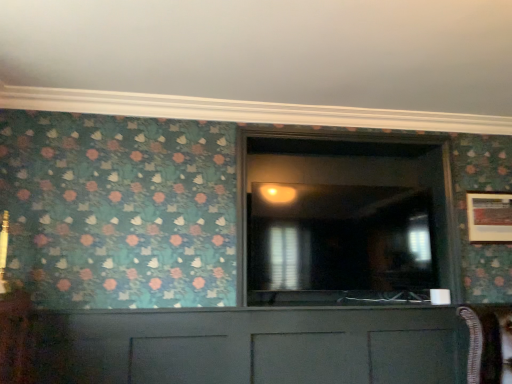
What is the approximate width of matte gray cabinet at center?

2.44 inches.

At what (x,y) coordinates should I click in order to perform the action: click on matte gray cabinet at center. Please return your answer as a coordinate pair (x, y). Looking at the image, I should click on (254, 346).

Would you say matte gray cabinet at center is outside wooden picture frame at right?

matte gray cabinet at center lies outside wooden picture frame at right's area.

Considering the positions of objects matte gray cabinet at center and wooden picture frame at right in the image provided, who is more to the right, matte gray cabinet at center or wooden picture frame at right?

wooden picture frame at right.

Considering the relative sizes of matte gray cabinet at center and wooden picture frame at right in the image provided, is matte gray cabinet at center wider than wooden picture frame at right?

Indeed, matte gray cabinet at center has a greater width compared to wooden picture frame at right.

From a real-world perspective, is matte gray cabinet at center physically located above or below wooden picture frame at right?

matte gray cabinet at center is below wooden picture frame at right.

Between matte gray cabinet at center and transparent glass door at center, which one appears on the right side from the viewer's perspective?

From the viewer's perspective, transparent glass door at center appears more on the right side.

Which object is thinner, matte gray cabinet at center or transparent glass door at center?

With smaller width is matte gray cabinet at center.

Identify the location of cabinetry below the transparent glass door at center (from the image's perspective). (254, 346).

Which object is wider, wooden picture frame at right or matte gray cabinet at center?

With larger width is matte gray cabinet at center.

Is wooden picture frame at right oriented away from matte gray cabinet at center?

No.

Considering the positions of objects wooden picture frame at right and matte gray cabinet at center in the image provided, who is more to the left, wooden picture frame at right or matte gray cabinet at center?

Positioned to the left is matte gray cabinet at center.

Considering the relative sizes of wooden picture frame at right and matte gray cabinet at center in the image provided, is wooden picture frame at right shorter than matte gray cabinet at center?

Indeed, wooden picture frame at right has a lesser height compared to matte gray cabinet at center.

From the image's perspective, is transparent glass door at center located above matte gray cabinet at center?

Yes, from the image's perspective, transparent glass door at center is above matte gray cabinet at center.

Looking at their sizes, would you say transparent glass door at center is wider or thinner than matte gray cabinet at center?

transparent glass door at center is wider than matte gray cabinet at center.

Is transparent glass door at center oriented towards matte gray cabinet at center?

No, transparent glass door at center does not turn towards matte gray cabinet at center.

From a real-world perspective, is transparent glass door at center positioned above or below wooden picture frame at right?

From a real-world perspective, transparent glass door at center is physically above wooden picture frame at right.

Is transparent glass door at center to the right of wooden picture frame at right from the viewer's perspective?

No.

Is transparent glass door at center positioned behind wooden picture frame at right?

No, transparent glass door at center is in front of wooden picture frame at right.

Is transparent glass door at center placed right next to wooden picture frame at right?

transparent glass door at center is not next to wooden picture frame at right, and they're not touching.

Could you tell me if wooden picture frame at right is facing transparent glass door at center?

No, wooden picture frame at right does not turn towards transparent glass door at center.

Locate an element on the screen. The height and width of the screenshot is (384, 512). picture frame located on the right of transparent glass door at center is located at coordinates (489, 217).

Is wooden picture frame at right to the right of transparent glass door at center from the viewer's perspective?

Correct, you'll find wooden picture frame at right to the right of transparent glass door at center.

Is wooden picture frame at right taller or shorter than transparent glass door at center?

In the image, wooden picture frame at right appears to be shorter than transparent glass door at center.

Locate an element on the screen. This screenshot has height=384, width=512. picture frame that is on the right side of matte gray cabinet at center is located at coordinates (489, 217).

Image resolution: width=512 pixels, height=384 pixels. In order to click on cabinetry on the left of the transparent glass door at center in this screenshot , I will do `click(254, 346)`.

Based on the photo, which object lies further to the anchor point wooden picture frame at right, matte gray cabinet at center or transparent glass door at center?

matte gray cabinet at center.

Which object lies further to the anchor point matte gray cabinet at center, wooden picture frame at right or transparent glass door at center?

The object further to matte gray cabinet at center is wooden picture frame at right.

Looking at the image, which one is located further to matte gray cabinet at center, transparent glass door at center or wooden picture frame at right?

The object further to matte gray cabinet at center is wooden picture frame at right.

From the image, which object appears to be nearer to transparent glass door at center, matte gray cabinet at center or wooden picture frame at right?

Among the two, matte gray cabinet at center is located nearer to transparent glass door at center.

From the image, which object appears to be nearer to transparent glass door at center, wooden picture frame at right or matte gray cabinet at center?

matte gray cabinet at center lies closer to transparent glass door at center than the other object.

Estimate the real-world distances between objects in this image. Which object is closer to wooden picture frame at right, transparent glass door at center or matte gray cabinet at center?

transparent glass door at center is closer to wooden picture frame at right.

You are a GUI agent. You are given a task and a screenshot of the screen. Output one action in this format:
    pyautogui.click(x=<x>, y=<y>)
    Task: Click on the glass door situated between matte gray cabinet at center and wooden picture frame at right from left to right
    
    Given the screenshot: What is the action you would take?
    pyautogui.click(x=348, y=215)